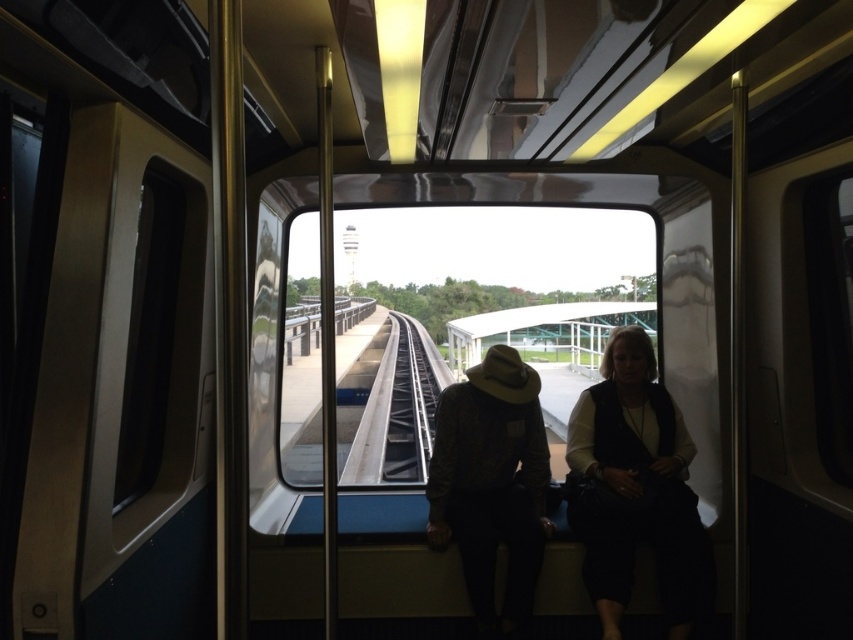
Question: Estimate the real-world distances between objects in this image. Which object is closer to the transparent glass train window at center?

Choices:
 (A) black metal train track at center
 (B) leather hat at center

Answer: (A)

Question: Observing the image, what is the correct spatial positioning of black fabric vest at right in reference to black metal train track at center?

Choices:
 (A) left
 (B) right

Answer: (B)

Question: Which of the following is the closest to the observer?

Choices:
 (A) (532, 404)
 (B) (688, 609)

Answer: (B)

Question: Considering the real-world distances, which object is closest to the black fabric vest at right?

Choices:
 (A) black metal train track at center
 (B) transparent glass train window at center
 (C) leather hat at center

Answer: (C)

Question: Is transparent glass train window at center in front of black metal train track at center?

Choices:
 (A) yes
 (B) no

Answer: (A)

Question: Observing the image, what is the correct spatial positioning of black fabric vest at right in reference to black metal train track at center?

Choices:
 (A) below
 (B) above

Answer: (B)